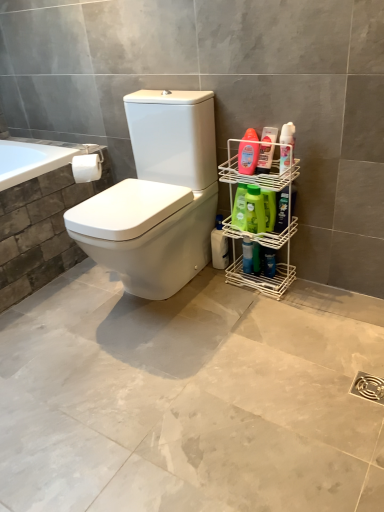
Find the location of a particular element. The image size is (384, 512). green matte bottle at center-right, acting as the sixth cleaning product starting from the front is located at coordinates (240, 207).

What do you see at coordinates (287, 146) in the screenshot?
I see `translucent plastic bottle at upper right, which is the 1th cleaning product in front-to-back order` at bounding box center [287, 146].

The width and height of the screenshot is (384, 512). What do you see at coordinates (269, 262) in the screenshot?
I see `blue glossy bottle at lower right` at bounding box center [269, 262].

Find the location of `translucent plastic bottle at right, the 7th cleaning product from the back`. translucent plastic bottle at right, the 7th cleaning product from the back is located at coordinates (265, 159).

Find the location of `blue glossy spray bottle at right, positioned as the first cleaning product in back-to-front order`. blue glossy spray bottle at right, positioned as the first cleaning product in back-to-front order is located at coordinates (247, 255).

What are the coordinates of `green plastic bottle at center right, marked as the 4th cleaning product in a front-to-back arrangement` in the screenshot? It's located at (255, 210).

The width and height of the screenshot is (384, 512). What are the coordinates of `green matte bottle at center-right, arranged as the third cleaning product when viewed from the back` in the screenshot? It's located at (240, 207).

From the image's perspective, which cleaning product is the 5th one below the translucent plastic bottle at right, arranged as the 3th cleaning product when viewed from the front? Please provide its 2D coordinates.

[(282, 210)]

In the image, is green matte bottle at right, marked as the 5th cleaning product in a front-to-back arrangement, on the left side or the right side of translucent plastic bottle at right, arranged as the 3th cleaning product when viewed from the front?

green matte bottle at right, marked as the 5th cleaning product in a front-to-back arrangement, is positioned on translucent plastic bottle at right, arranged as the 3th cleaning product when viewed from the front,'s right side.

From a real-world perspective, does green matte bottle at right, marked as the 5th cleaning product in a front-to-back arrangement, stand above translucent plastic bottle at right, arranged as the 3th cleaning product when viewed from the front?

No, from a real-world perspective, green matte bottle at right, marked as the 5th cleaning product in a front-to-back arrangement, is not above translucent plastic bottle at right, arranged as the 3th cleaning product when viewed from the front.

Is green matte bottle at right, which is counted as the fourth cleaning product, starting from the back, oriented towards translucent plastic bottle at right, which is the 6th cleaning product from back to front?

No, green matte bottle at right, which is counted as the fourth cleaning product, starting from the back, is not oriented towards translucent plastic bottle at right, which is the 6th cleaning product from back to front.

Considering the sizes of white plastic bottle at lower right, the 7th cleaning product when ordered from front to back, and translucent plastic bottle at right, the 7th cleaning product from the back, in the image, is white plastic bottle at lower right, the 7th cleaning product when ordered from front to back, bigger or smaller than translucent plastic bottle at right, the 7th cleaning product from the back,?

white plastic bottle at lower right, the 7th cleaning product when ordered from front to back, is bigger than translucent plastic bottle at right, the 7th cleaning product from the back.

What's the angular difference between white plastic bottle at lower right, the 7th cleaning product when ordered from front to back, and translucent plastic bottle at right, positioned as the 2th cleaning product in front-to-back order,'s facing directions?

The facing directions of white plastic bottle at lower right, the 7th cleaning product when ordered from front to back, and translucent plastic bottle at right, positioned as the 2th cleaning product in front-to-back order, are 4.07 degrees apart.

From the image's perspective, is white plastic bottle at lower right, the second cleaning product when ordered from back to front, above or below translucent plastic bottle at right, positioned as the 2th cleaning product in front-to-back order?

Based on their image positions, white plastic bottle at lower right, the second cleaning product when ordered from back to front, is located beneath translucent plastic bottle at right, positioned as the 2th cleaning product in front-to-back order.

Can you see white plastic bottle at lower right, the 7th cleaning product when ordered from front to back, touching translucent plastic bottle at right, positioned as the 2th cleaning product in front-to-back order?

white plastic bottle at lower right, the 7th cleaning product when ordered from front to back, and translucent plastic bottle at right, positioned as the 2th cleaning product in front-to-back order, are clearly separated.

From a real-world perspective, does green matte bottle at center-right, acting as the sixth cleaning product starting from the front, sit lower than green plastic bottle at center right, which is counted as the fifth cleaning product, starting from the back?

Yes, from a real-world perspective, green matte bottle at center-right, acting as the sixth cleaning product starting from the front, is under green plastic bottle at center right, which is counted as the fifth cleaning product, starting from the back.

Would you say green matte bottle at center-right, arranged as the third cleaning product when viewed from the back, is a long distance from green plastic bottle at center right, marked as the 4th cleaning product in a front-to-back arrangement?

They are positioned close to each other.

From the image's perspective, is green matte bottle at center-right, arranged as the third cleaning product when viewed from the back, beneath green plastic bottle at center right, marked as the 4th cleaning product in a front-to-back arrangement?

No, from the image's perspective, green matte bottle at center-right, arranged as the third cleaning product when viewed from the back, is not below green plastic bottle at center right, marked as the 4th cleaning product in a front-to-back arrangement.

Does green matte bottle at center-right, acting as the sixth cleaning product starting from the front, lie in front of green plastic bottle at center right, marked as the 4th cleaning product in a front-to-back arrangement?

No, the depth of green matte bottle at center-right, acting as the sixth cleaning product starting from the front, is greater than that of green plastic bottle at center right, marked as the 4th cleaning product in a front-to-back arrangement.

Is point (247, 148) positioned before point (280, 264)?

Yes, point (247, 148) is closer to viewer.

Is translucent plastic bottle at right, which is the 6th cleaning product from back to front, behind white plastic rack at right?

That is True.

Consider the image. From a real-world perspective, is translucent plastic bottle at right, which is the 6th cleaning product from back to front, positioned under white plastic rack at right based on gravity?

Incorrect, from a real-world perspective, translucent plastic bottle at right, which is the 6th cleaning product from back to front, is higher than white plastic rack at right.

Which is behind, point (227, 253) or point (246, 199)?

The point (227, 253) is farther from the camera.

From a real-world perspective, is white plastic bottle at lower right, the second cleaning product when ordered from back to front, physically below green plastic bottle at center right, marked as the 4th cleaning product in a front-to-back arrangement?

Correct, in the physical world, white plastic bottle at lower right, the second cleaning product when ordered from back to front, is lower than green plastic bottle at center right, marked as the 4th cleaning product in a front-to-back arrangement.

What's the angular difference between white plastic bottle at lower right, the second cleaning product when ordered from back to front, and green plastic bottle at center right, marked as the 4th cleaning product in a front-to-back arrangement,'s facing directions?

white plastic bottle at lower right, the second cleaning product when ordered from back to front, and green plastic bottle at center right, marked as the 4th cleaning product in a front-to-back arrangement, are facing 5.44 degrees away from each other.

Is white plastic bottle at lower right, the 7th cleaning product when ordered from front to back, at the left side of green plastic bottle at center right, which is counted as the fifth cleaning product, starting from the back?

Correct, you'll find white plastic bottle at lower right, the 7th cleaning product when ordered from front to back, to the left of green plastic bottle at center right, which is counted as the fifth cleaning product, starting from the back.

What's the angular difference between green matte bottle at center-right, arranged as the third cleaning product when viewed from the back, and green matte bottle at right, marked as the 5th cleaning product in a front-to-back arrangement,'s facing directions?

There is a 5.58-degree angle between the facing directions of green matte bottle at center-right, arranged as the third cleaning product when viewed from the back, and green matte bottle at right, marked as the 5th cleaning product in a front-to-back arrangement.

From the image's perspective, would you say green matte bottle at center-right, arranged as the third cleaning product when viewed from the back, is positioned over green matte bottle at right, marked as the 5th cleaning product in a front-to-back arrangement?

Indeed, from the image's perspective, green matte bottle at center-right, arranged as the third cleaning product when viewed from the back, is shown above green matte bottle at right, marked as the 5th cleaning product in a front-to-back arrangement.

Between green matte bottle at center-right, acting as the sixth cleaning product starting from the front, and green matte bottle at right, marked as the 5th cleaning product in a front-to-back arrangement, which one appears on the left side from the viewer's perspective?

Positioned to the left is green matte bottle at center-right, acting as the sixth cleaning product starting from the front.

Does point (240, 191) come farther from viewer compared to point (278, 232)?

No, it is in front of (278, 232).

Between green matte bottle at center-right, arranged as the third cleaning product when viewed from the back, and white plastic rack at right, which one appears on the right side from the viewer's perspective?

From the viewer's perspective, white plastic rack at right appears more on the right side.

Can we say green matte bottle at center-right, acting as the sixth cleaning product starting from the front, lies outside white plastic rack at right?

That's incorrect, green matte bottle at center-right, acting as the sixth cleaning product starting from the front, is not completely outside white plastic rack at right.

From a real-world perspective, is green matte bottle at center-right, acting as the sixth cleaning product starting from the front, positioned under white plastic rack at right based on gravity?

No, from a real-world perspective, green matte bottle at center-right, acting as the sixth cleaning product starting from the front, is not under white plastic rack at right.

Is green matte bottle at center-right, arranged as the third cleaning product when viewed from the back, closer to the viewer compared to white plastic rack at right?

No, it is not.

From the translucent plastic bottle at right, arranged as the 3th cleaning product when viewed from the front, count 2nd cleaning products backward and point to it. Please provide its 2D coordinates.

[(282, 210)]

You are a GUI agent. You are given a task and a screenshot of the screen. Output one action in this format:
    pyautogui.click(x=<x>, y=<y>)
    Task: Click on the 5th cleaning product above the white plastic bottle at lower right, the 7th cleaning product when ordered from front to back (from the image's perspective)
    Image resolution: width=384 pixels, height=512 pixels.
    Given the screenshot: What is the action you would take?
    pyautogui.click(x=265, y=159)

Which object lies nearer to the anchor point white matte toilet paper at upper left, translucent plastic bottle at right, arranged as the 3th cleaning product when viewed from the front, or white plastic rack at right?

The object closer to white matte toilet paper at upper left is translucent plastic bottle at right, arranged as the 3th cleaning product when viewed from the front.

Considering their positions, is green plastic bottle at center right, which is counted as the fifth cleaning product, starting from the back, positioned closer to blue glossy spray bottle at right, the eighth cleaning product in the front-to-back sequence, than blue glossy bottle at lower right?

blue glossy bottle at lower right is positioned closer to the anchor blue glossy spray bottle at right, the eighth cleaning product in the front-to-back sequence.

When comparing their distances from white plastic rack at right, does blue glossy bottle at lower right or green matte bottle at center-right, arranged as the third cleaning product when viewed from the back, seem further?

blue glossy bottle at lower right.

From the image, which object appears to be farther from blue glossy spray bottle at right, the eighth cleaning product in the front-to-back sequence, white plastic bottle at lower right, the 7th cleaning product when ordered from front to back, or green matte bottle at center-right, arranged as the third cleaning product when viewed from the back?

Based on the image, green matte bottle at center-right, arranged as the third cleaning product when viewed from the back, appears to be further to blue glossy spray bottle at right, the eighth cleaning product in the front-to-back sequence.

Looking at the image, which one is located further to translucent plastic bottle at right, which is the 6th cleaning product from back to front, green plastic bottle at center right, marked as the 4th cleaning product in a front-to-back arrangement, or green matte bottle at center-right, arranged as the third cleaning product when viewed from the back?

green plastic bottle at center right, marked as the 4th cleaning product in a front-to-back arrangement, lies further to translucent plastic bottle at right, which is the 6th cleaning product from back to front, than the other object.

From the picture: Looking at the image, which one is located further to translucent plastic bottle at right, which is the 6th cleaning product from back to front, translucent plastic bottle at upper right, which is the 1th cleaning product in front-to-back order, or blue glossy spray bottle at right, positioned as the first cleaning product in back-to-front order?

The object further to translucent plastic bottle at right, which is the 6th cleaning product from back to front, is blue glossy spray bottle at right, positioned as the first cleaning product in back-to-front order.

Estimate the real-world distances between objects in this image. Which object is closer to blue glossy bottle at lower right, blue glossy spray bottle at right, positioned as the first cleaning product in back-to-front order, or green matte bottle at center-right, acting as the sixth cleaning product starting from the front?

blue glossy spray bottle at right, positioned as the first cleaning product in back-to-front order, is closer to blue glossy bottle at lower right.

Based on their spatial positions, is white plastic rack at right or green matte bottle at right, marked as the 5th cleaning product in a front-to-back arrangement, further from translucent plastic bottle at right, the 7th cleaning product from the back?

white plastic rack at right lies further to translucent plastic bottle at right, the 7th cleaning product from the back, than the other object.

I want to click on porcelain between translucent plastic bottle at right, arranged as the 3th cleaning product when viewed from the front, and blue glossy bottle at lower right from top to bottom, so click(266, 247).

This screenshot has width=384, height=512. I want to click on toiletry between green matte bottle at right, which is counted as the fourth cleaning product, starting from the back, and blue glossy spray bottle at right, the eighth cleaning product in the front-to-back sequence, along the z-axis, so click(269, 262).

Where is `toiletry between white plastic rack at right and blue glossy spray bottle at right, positioned as the first cleaning product in back-to-front order, in the front-back direction`? This screenshot has width=384, height=512. toiletry between white plastic rack at right and blue glossy spray bottle at right, positioned as the first cleaning product in back-to-front order, in the front-back direction is located at coordinates (269, 262).

You are a GUI agent. You are given a task and a screenshot of the screen. Output one action in this format:
    pyautogui.click(x=<x>, y=<y>)
    Task: Click on the toiletry situated between white matte toilet paper at upper left and translucent plastic bottle at upper right, acting as the 8th cleaning product starting from the back, from left to right
    
    Given the screenshot: What is the action you would take?
    pyautogui.click(x=269, y=262)